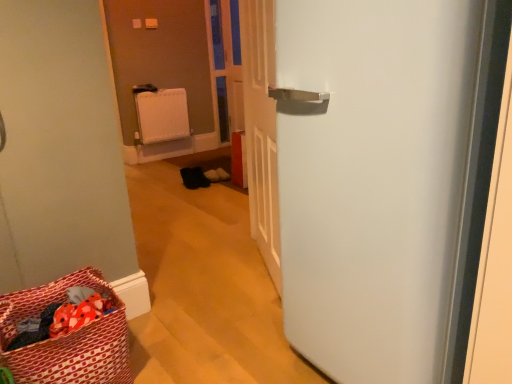
Where is `red fabric laundry basket at lower left`? The height and width of the screenshot is (384, 512). red fabric laundry basket at lower left is located at coordinates (67, 338).

In order to face red fabric laundry basket at lower left, should I rotate leftwards or rightwards?

Turn left by 24.290 degrees to look at red fabric laundry basket at lower left.

In order to click on transparent plastic screen door at center in this screenshot , I will do 226,64.

This screenshot has width=512, height=384. What do you see at coordinates (162, 115) in the screenshot?
I see `white plastic radiator at center` at bounding box center [162, 115].

At what (x,y) coordinates should I click in order to perform the action: click on red fabric laundry basket at lower left. Please return your answer as a coordinate pair (x, y). The height and width of the screenshot is (384, 512). Looking at the image, I should click on (67, 338).

From a real-world perspective, who is located higher, red fabric laundry basket at lower left or white plastic radiator at center?

From a 3D spatial view, white plastic radiator at center is above.

Is red fabric laundry basket at lower left turned away from white plastic radiator at center?

No, red fabric laundry basket at lower left is not facing the opposite direction of white plastic radiator at center.

Between red fabric laundry basket at lower left and white plastic radiator at center, which one is positioned behind?

white plastic radiator at center.

Between white matte refrigerator at right and red fabric laundry basket at lower left, which one has smaller size?

red fabric laundry basket at lower left.

Find the location of a particular element. laundry basket behind the white matte refrigerator at right is located at coordinates (67, 338).

Measure the distance from white matte refrigerator at right to red fabric laundry basket at lower left.

white matte refrigerator at right and red fabric laundry basket at lower left are 84.34 centimeters apart from each other.

Considering the sizes of objects white matte refrigerator at right and red fabric laundry basket at lower left in the image provided, who is shorter, white matte refrigerator at right or red fabric laundry basket at lower left?

red fabric laundry basket at lower left is shorter.

Looking at this image, from the image's perspective, between white plastic radiator at center and transparent plastic screen door at center, who is located below?

white plastic radiator at center appears lower in the image.

Is white plastic radiator at center not within transparent plastic screen door at center?

Indeed, white plastic radiator at center is completely outside transparent plastic screen door at center.

Based on the photo, looking at their sizes, would you say white plastic radiator at center is wider or thinner than transparent plastic screen door at center?

Clearly, white plastic radiator at center has more width compared to transparent plastic screen door at center.

From the picture: Considering the sizes of objects white plastic radiator at center and transparent plastic screen door at center in the image provided, who is bigger, white plastic radiator at center or transparent plastic screen door at center?

With larger size is white plastic radiator at center.

Measure the distance between white matte refrigerator at right and white plastic radiator at center.

white matte refrigerator at right and white plastic radiator at center are 3.57 meters apart from each other.

From a real-world perspective, which is physically below, white matte refrigerator at right or white plastic radiator at center?

white plastic radiator at center is physically lower.

Is white plastic radiator at center completely or partially inside white matte refrigerator at right?

Actually, white plastic radiator at center is outside white matte refrigerator at right.

From the image's perspective, does white matte refrigerator at right appear higher than white plastic radiator at center?

Actually, white matte refrigerator at right appears below white plastic radiator at center in the image.

Does red fabric laundry basket at lower left have a lesser width compared to white matte refrigerator at right?

Yes, red fabric laundry basket at lower left is thinner than white matte refrigerator at right.

Which point is more distant from viewer, (x=33, y=306) or (x=425, y=82)?

Point (x=33, y=306)

Can you confirm if red fabric laundry basket at lower left is shorter than white matte refrigerator at right?

Indeed, red fabric laundry basket at lower left has a lesser height compared to white matte refrigerator at right.

Is red fabric laundry basket at lower left to the left or to the right of white matte refrigerator at right in the image?

red fabric laundry basket at lower left is to the left of white matte refrigerator at right.

Considering the positions of objects transparent plastic screen door at center and white matte refrigerator at right in the image provided, who is more to the left, transparent plastic screen door at center or white matte refrigerator at right?

From the viewer's perspective, transparent plastic screen door at center appears more on the left side.

Measure the distance from transparent plastic screen door at center to white matte refrigerator at right.

They are 3.50 meters apart.

Is transparent plastic screen door at center oriented away from white matte refrigerator at right?

transparent plastic screen door at center does not have its back to white matte refrigerator at right.

Considering the sizes of objects transparent plastic screen door at center and white matte refrigerator at right in the image provided, who is smaller, transparent plastic screen door at center or white matte refrigerator at right?

transparent plastic screen door at center.

Does red fabric laundry basket at lower left have a larger size compared to transparent plastic screen door at center?

Indeed, red fabric laundry basket at lower left has a larger size compared to transparent plastic screen door at center.

Would you say red fabric laundry basket at lower left contains transparent plastic screen door at center?

Actually, transparent plastic screen door at center is outside red fabric laundry basket at lower left.

Based on the photo, from a real-world perspective, is red fabric laundry basket at lower left positioned above or below transparent plastic screen door at center?

Clearly, from a real-world perspective, red fabric laundry basket at lower left is below transparent plastic screen door at center.

Who is taller, red fabric laundry basket at lower left or transparent plastic screen door at center?

With more height is transparent plastic screen door at center.

The width and height of the screenshot is (512, 384). Find the location of `laundry basket that is on the right side of white plastic radiator at center`. laundry basket that is on the right side of white plastic radiator at center is located at coordinates (67, 338).

There is a red fabric laundry basket at lower left. Identify the location of door above it (from a real-world perspective). (374, 180).

Estimate the real-world distances between objects in this image. Which object is further from red fabric laundry basket at lower left, white matte refrigerator at right or white plastic radiator at center?

white plastic radiator at center is further to red fabric laundry basket at lower left.

Estimate the real-world distances between objects in this image. Which object is further from transparent plastic screen door at center, red fabric laundry basket at lower left or white plastic radiator at center?

red fabric laundry basket at lower left lies further to transparent plastic screen door at center than the other object.

From the image, which object appears to be nearer to transparent plastic screen door at center, white plastic radiator at center or white matte refrigerator at right?

white plastic radiator at center lies closer to transparent plastic screen door at center than the other object.

When comparing their distances from white plastic radiator at center, does white matte refrigerator at right or red fabric laundry basket at lower left seem further?

The object further to white plastic radiator at center is white matte refrigerator at right.

Looking at the image, which one is located closer to white matte refrigerator at right, red fabric laundry basket at lower left or transparent plastic screen door at center?

Based on the image, red fabric laundry basket at lower left appears to be nearer to white matte refrigerator at right.

From the image, which object appears to be farther from white plastic radiator at center, red fabric laundry basket at lower left or white matte refrigerator at right?

white matte refrigerator at right is positioned further to the anchor white plastic radiator at center.

Looking at the image, which one is located further to white matte refrigerator at right, transparent plastic screen door at center or red fabric laundry basket at lower left?

Among the two, transparent plastic screen door at center is located further to white matte refrigerator at right.

Considering their positions, is white matte refrigerator at right positioned further to transparent plastic screen door at center than red fabric laundry basket at lower left?

white matte refrigerator at right.

Locate an element on the screen. laundry basket between white matte refrigerator at right and transparent plastic screen door at center from front to back is located at coordinates (67, 338).

Where is `laundry basket located between white matte refrigerator at right and white plastic radiator at center in the depth direction`? laundry basket located between white matte refrigerator at right and white plastic radiator at center in the depth direction is located at coordinates (67, 338).

Identify the location of radiator between white matte refrigerator at right and transparent plastic screen door at center along the z-axis. (162, 115).

Locate an element on the screen. This screenshot has height=384, width=512. radiator between red fabric laundry basket at lower left and transparent plastic screen door at center in the front-back direction is located at coordinates (162, 115).